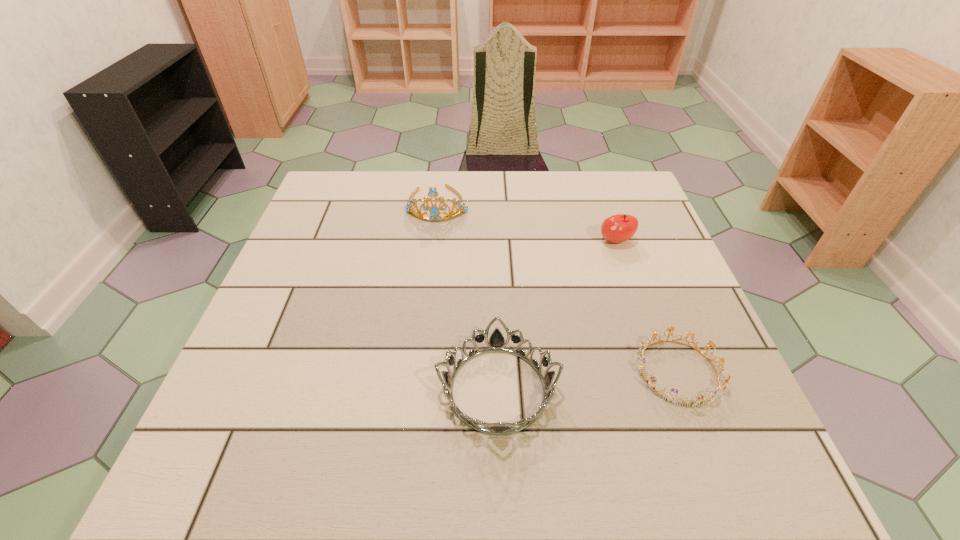
Where is `vacant area between the shortest tiara and the second shortest object`? The height and width of the screenshot is (540, 960). vacant area between the shortest tiara and the second shortest object is located at coordinates (588, 381).

Identify the location of free space between the second shortest tiara and the farthest tiara. The height and width of the screenshot is (540, 960). (468, 296).

You are a GUI agent. You are given a task and a screenshot of the screen. Output one action in this format:
    pyautogui.click(x=<x>, y=<y>)
    Task: Click on the free space that is in between the second farthest object and the third tallest object
    
    Given the screenshot: What is the action you would take?
    pyautogui.click(x=557, y=315)

Where is `free space between the shortest tiara and the second tallest tiara`? free space between the shortest tiara and the second tallest tiara is located at coordinates (588, 381).

Locate an element on the screen. The width and height of the screenshot is (960, 540). vacant area between the second farthest object and the second shortest tiara is located at coordinates [557, 315].

You are a GUI agent. You are given a task and a screenshot of the screen. Output one action in this format:
    pyautogui.click(x=<x>, y=<y>)
    Task: Click on the vacant point located between the farthest tiara and the shortest object
    The image size is (960, 540).
    Given the screenshot: What is the action you would take?
    pyautogui.click(x=558, y=288)

Where is `vacant space in between the rightmost tiara and the tallest tiara`? The width and height of the screenshot is (960, 540). vacant space in between the rightmost tiara and the tallest tiara is located at coordinates (558, 288).

This screenshot has height=540, width=960. I want to click on free space between the second shortest object and the farthest tiara, so click(x=468, y=296).

This screenshot has width=960, height=540. Identify the location of vacant region between the third tallest object and the farthest tiara. (468, 296).

The height and width of the screenshot is (540, 960). What are the coordinates of `the closest object relative to the second farthest object` in the screenshot? It's located at (689, 402).